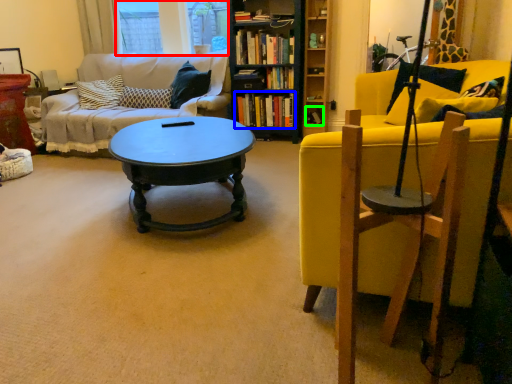
Question: Which is nearer to the window screen (highlighted by a red box)? book (highlighted by a blue box) or book (highlighted by a green box).

Choices:
 (A) book
 (B) book

Answer: (A)